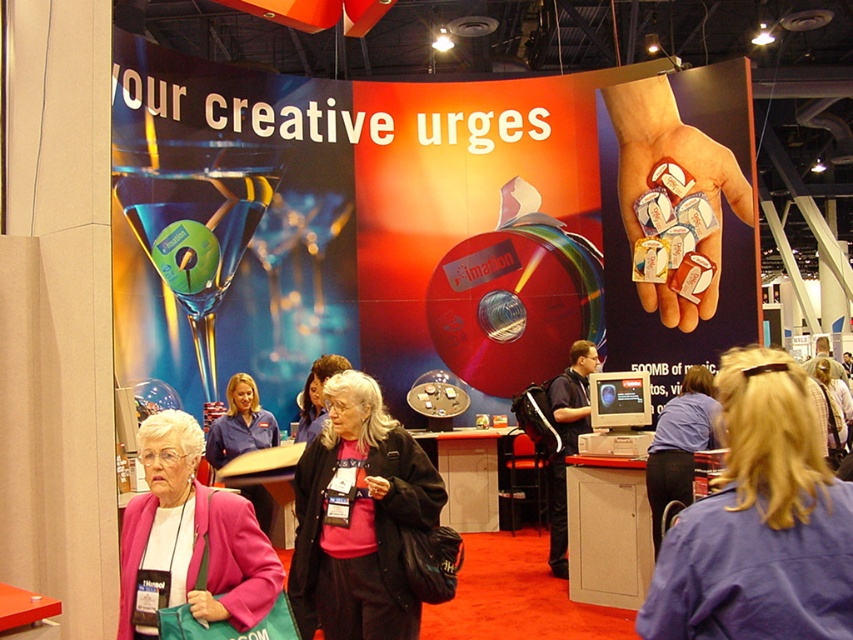
Between pink fabric jacket at lower left and blue shirt at center, which one is positioned lower?

blue shirt at center is below.

Can you confirm if pink fabric jacket at lower left is positioned below blue shirt at center?

Actually, pink fabric jacket at lower left is above blue shirt at center.

Measure the distance between point (x=178, y=460) and camera.

The distance of point (x=178, y=460) from camera is 3.20 meters.

You are a GUI agent. You are given a task and a screenshot of the screen. Output one action in this format:
    pyautogui.click(x=<x>, y=<y>)
    Task: Click on the pink fabric jacket at lower left
    This screenshot has width=853, height=640.
    Given the screenshot: What is the action you would take?
    pyautogui.click(x=189, y=540)

Does blonde hair at upper right have a greater width compared to pink matte jacket at center?

No.

Does blonde hair at upper right have a greater height compared to pink matte jacket at center?

No, blonde hair at upper right is not taller than pink matte jacket at center.

In order to click on blonde hair at upper right in this screenshot , I will do `click(759, 522)`.

The image size is (853, 640). I want to click on blonde hair at upper right, so click(759, 522).

Does pink matte jacket at center have a larger size compared to blue shirt at center?

Yes, pink matte jacket at center is bigger than blue shirt at center.

Can you confirm if pink matte jacket at center is shorter than blue shirt at center?

In fact, pink matte jacket at center may be taller than blue shirt at center.

This screenshot has height=640, width=853. I want to click on pink matte jacket at center, so click(x=358, y=518).

Identify the location of pink matte jacket at center. Image resolution: width=853 pixels, height=640 pixels. (358, 518).